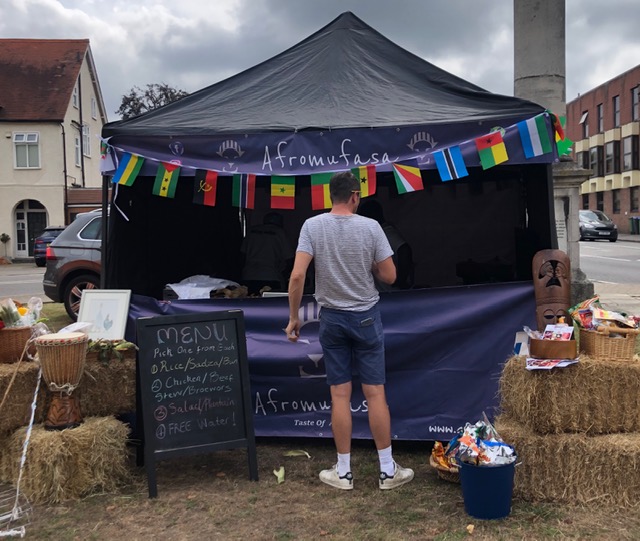
Identify the location of blue bucket. click(486, 489).